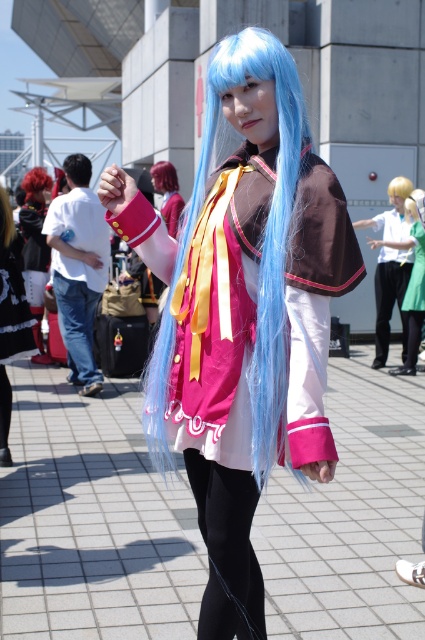
Question: Which of these objects is positioned farthest from the matte pink blouse at center?

Choices:
 (A) shiny red hair at center
 (B) brown matte hair at upper left
 (C) blonde silky wig at center

Answer: (B)

Question: Estimate the real-world distances between objects in this image. Which object is closer to the matte pink fabric dress at center?

Choices:
 (A) blonde silky wig at center
 (B) matte black dress at lower left

Answer: (A)

Question: Does matte black dress at center appear under blonde silky wig at center?

Choices:
 (A) no
 (B) yes

Answer: (B)

Question: Is brown matte hair at upper left further to camera compared to vivid red hair at center?

Choices:
 (A) no
 (B) yes

Answer: (A)

Question: Which point appears closest to the camera in this image?

Choices:
 (A) (14, 310)
 (B) (85, 160)
 (C) (158, 168)

Answer: (A)

Question: Considering the relative positions of brown matte hair at upper left and shiny red hair at center in the image provided, where is brown matte hair at upper left located with respect to shiny red hair at center?

Choices:
 (A) left
 (B) right

Answer: (A)